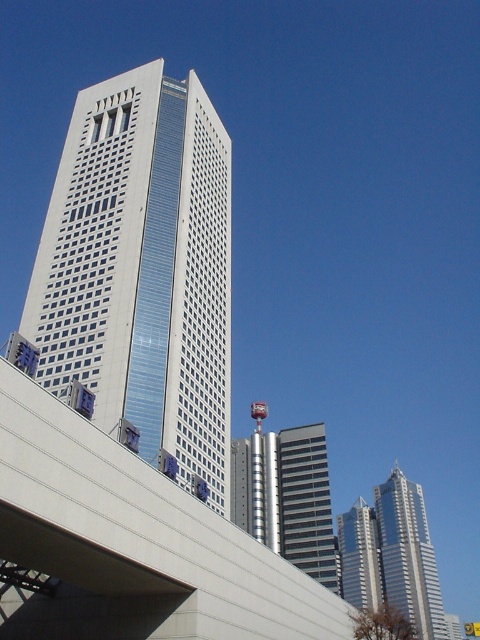
Between shiny silver skyscraper at right and silver metallic skyscraper at center, which one has more height?

Standing taller between the two is shiny silver skyscraper at right.

Is shiny silver skyscraper at right taller than silver metallic skyscraper at center?

Yes.

Describe the element at coordinates (408, 556) in the screenshot. The height and width of the screenshot is (640, 480). I see `shiny silver skyscraper at right` at that location.

This screenshot has width=480, height=640. I want to click on shiny silver skyscraper at right, so click(408, 556).

Where is `concrete overpass at center`? This screenshot has width=480, height=640. concrete overpass at center is located at coordinates (132, 541).

Between point (240, 563) and point (387, 531), which one is positioned behind?

The point (387, 531) is behind.

I want to click on concrete overpass at center, so click(x=132, y=541).

This screenshot has height=640, width=480. What do you see at coordinates (132, 541) in the screenshot? I see `concrete overpass at center` at bounding box center [132, 541].

Who is lower down, concrete overpass at center or dark gray glass building at center?

dark gray glass building at center is lower down.

Does point (292, 618) come behind point (328, 541)?

No, (292, 618) is in front of (328, 541).

Where is `concrete overpass at center`? concrete overpass at center is located at coordinates coord(132,541).